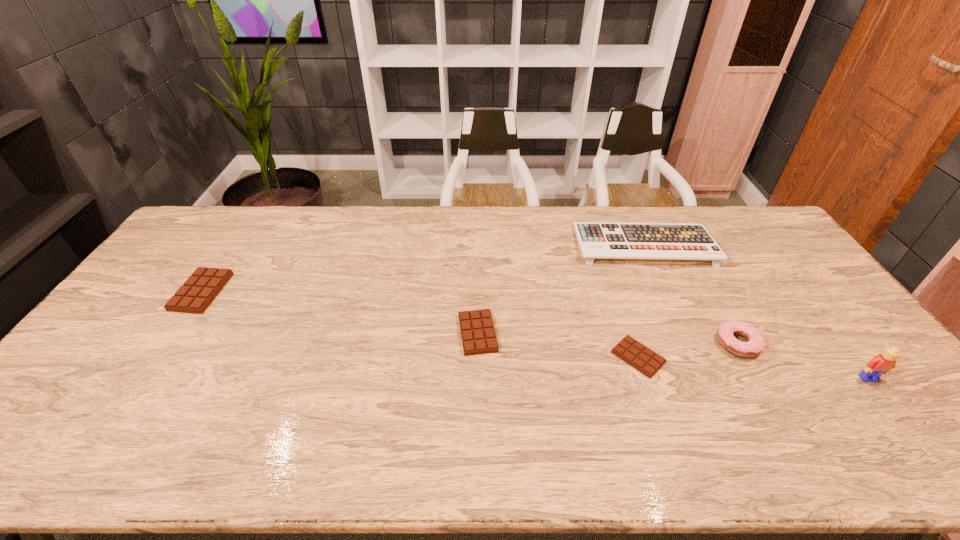
This screenshot has height=540, width=960. Identify the location of free space at the near edge. tap(292, 395).

Where is `free spot at the left edge of the desktop`? free spot at the left edge of the desktop is located at coordinates (81, 359).

Locate an element on the screen. vacant space at the right edge is located at coordinates (865, 364).

In the image, there is a desktop. Where is `free space at the far left corner`? The width and height of the screenshot is (960, 540). free space at the far left corner is located at coordinates (219, 231).

The image size is (960, 540). Find the location of `vacant area between the computer keyboard and the third shortest object`. vacant area between the computer keyboard and the third shortest object is located at coordinates (422, 268).

Identify the location of vacant space that is in between the farthest object and the shortest candy bar. Image resolution: width=960 pixels, height=540 pixels. (641, 301).

Locate an element on the screen. The image size is (960, 540). empty space that is in between the shortest object and the Lego is located at coordinates (754, 368).

You are a GUI agent. You are given a task and a screenshot of the screen. Output one action in this format:
    pyautogui.click(x=<x>, y=<y>)
    Task: Click on the unoccupied position between the computer keyboard and the second candy bar from right to left
    
    Given the screenshot: What is the action you would take?
    pyautogui.click(x=561, y=289)

Locate an element on the screen. vacant area that lies between the tallest object and the rightmost candy bar is located at coordinates (754, 368).

What are the coordinates of `free area in between the shortest object and the farthest object` in the screenshot? It's located at (641, 301).